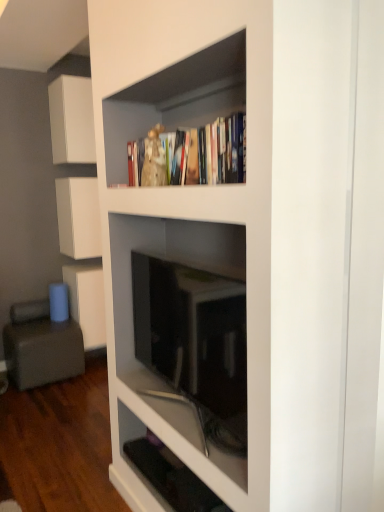
Question: Is white matte cabinet at upper left, the second cabinetry in the top-to-bottom sequence, at the left side of gray fabric armchair at lower left?

Choices:
 (A) no
 (B) yes

Answer: (A)

Question: From a real-world perspective, is white matte cabinet at upper left, the second cabinetry in the top-to-bottom sequence, on gray fabric armchair at lower left?

Choices:
 (A) no
 (B) yes

Answer: (B)

Question: Can you confirm if white matte cabinet at upper left, the 2th cabinetry ordered from the bottom, is shorter than gray fabric armchair at lower left?

Choices:
 (A) yes
 (B) no

Answer: (B)

Question: Is white matte cabinet at upper left, the second cabinetry in the top-to-bottom sequence, oriented away from gray fabric armchair at lower left?

Choices:
 (A) no
 (B) yes

Answer: (A)

Question: Is white matte cabinet at upper left, the 2th cabinetry ordered from the bottom, positioned before gray fabric armchair at lower left?

Choices:
 (A) no
 (B) yes

Answer: (A)

Question: From the image's perspective, is white matte cabinet at upper left, the second cabinetry in the top-to-bottom sequence, located beneath gray fabric armchair at lower left?

Choices:
 (A) no
 (B) yes

Answer: (A)

Question: Can you confirm if black glossy shelf at lower center, positioned as the 1th shelf in bottom-to-top order, is wider than matte black tv at center, marked as the 2th shelf in a bottom-to-top arrangement?

Choices:
 (A) no
 (B) yes

Answer: (B)

Question: Is black glossy shelf at lower center, positioned as the 1th shelf in bottom-to-top order, oriented towards matte black tv at center, marked as the 2th shelf in a bottom-to-top arrangement?

Choices:
 (A) yes
 (B) no

Answer: (B)

Question: From the image's perspective, does black glossy shelf at lower center, the second shelf viewed from the top, appear higher than matte black tv at center, which ranks as the 1th shelf in top-to-bottom order?

Choices:
 (A) yes
 (B) no

Answer: (B)

Question: From the image's perspective, is black glossy shelf at lower center, the second shelf viewed from the top, below matte black tv at center, marked as the 2th shelf in a bottom-to-top arrangement?

Choices:
 (A) no
 (B) yes

Answer: (B)

Question: From a real-world perspective, is black glossy shelf at lower center, the second shelf viewed from the top, over matte black tv at center, marked as the 2th shelf in a bottom-to-top arrangement?

Choices:
 (A) yes
 (B) no

Answer: (B)

Question: Is the surface of black glossy shelf at lower center, the second shelf viewed from the top, in direct contact with matte black tv at center, which ranks as the 1th shelf in top-to-bottom order?

Choices:
 (A) no
 (B) yes

Answer: (A)

Question: Does gray fabric armchair at lower left lie behind matte black tv at center, which ranks as the 1th shelf in top-to-bottom order?

Choices:
 (A) yes
 (B) no

Answer: (A)